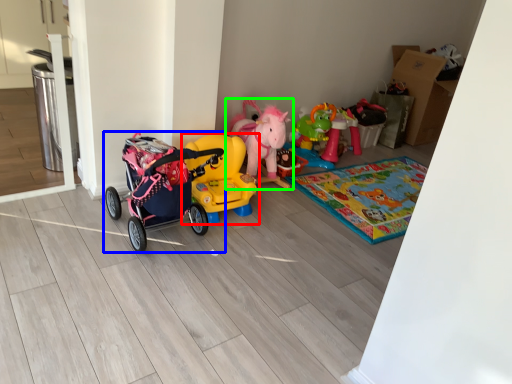
Question: Which object is the farthest from toy (highlighted by a red box)? Choose among these: toy (highlighted by a blue box) or toy (highlighted by a green box).

Choices:
 (A) toy
 (B) toy

Answer: (B)